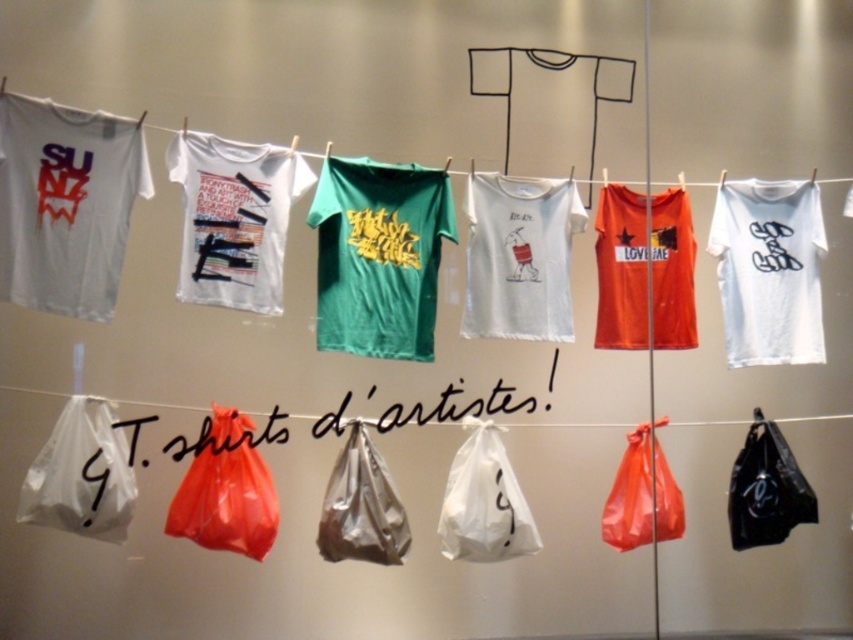
Question: Among these objects, which one is farthest from the camera?

Choices:
 (A) white matte t-shirt at left
 (B) black plastic bag at lower right

Answer: (B)

Question: Is white cotton t-shirt at center above white cotton t-shirts at upper center?

Choices:
 (A) no
 (B) yes

Answer: (A)

Question: Does shiny plastic bag at lower center have a greater width compared to white cotton t-shirts at upper center?

Choices:
 (A) no
 (B) yes

Answer: (A)

Question: Based on their relative distances, which object is nearer to the white matte t-shirt at center?

Choices:
 (A) shiny plastic bag at center
 (B) green fabric t-shirt at center

Answer: (B)

Question: Considering the relative positions of white matte t-shirt at right and shiny metallic bag at center in the image provided, where is white matte t-shirt at right located with respect to shiny metallic bag at center?

Choices:
 (A) left
 (B) right

Answer: (B)

Question: Which of the following is the closest to the observer?

Choices:
 (A) (68, 134)
 (B) (790, 483)
 (C) (73, 401)

Answer: (C)